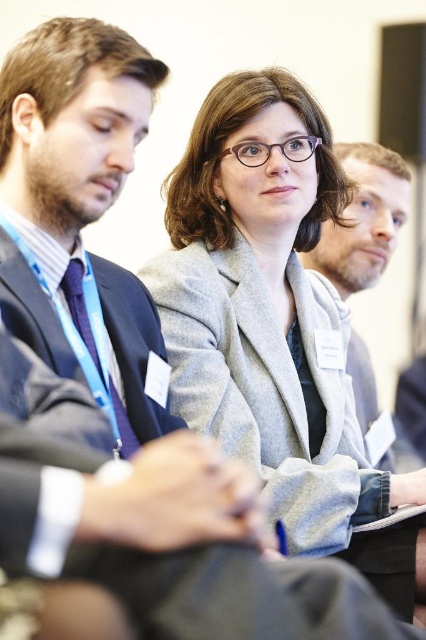
Can you confirm if gray woolen blazer at center is bigger than gray woolen jacket at center?

Yes.

Does gray woolen blazer at center appear on the right side of gray woolen jacket at center?

In fact, gray woolen blazer at center is to the left of gray woolen jacket at center.

Image resolution: width=426 pixels, height=640 pixels. Identify the location of gray woolen blazer at center. (276, 324).